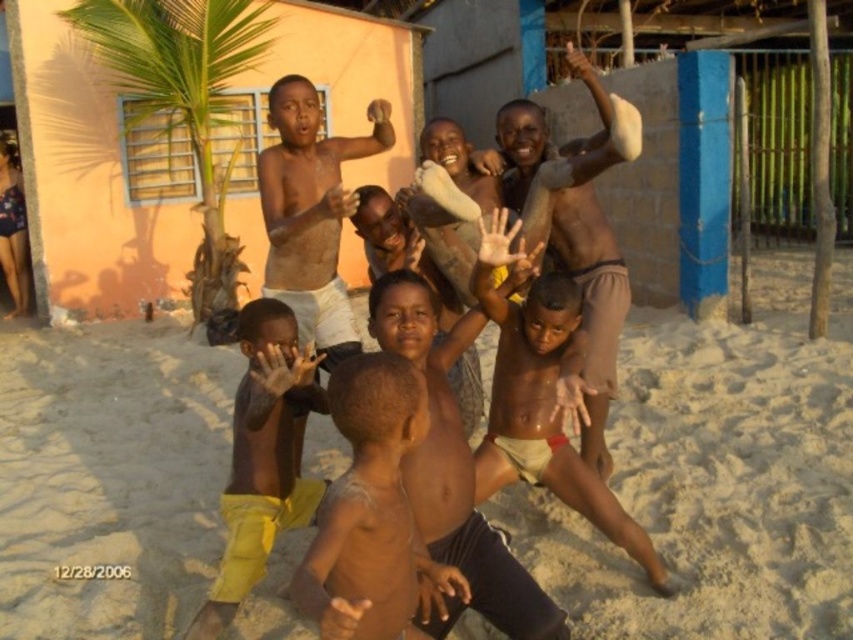
Who is positioned more to the left, brown skin man at center or shiny skin boy at center?

shiny skin boy at center is more to the left.

Can you confirm if brown skin man at center is shorter than shiny skin boy at center?

No.

Where is `brown skin man at center`? The height and width of the screenshot is (640, 853). brown skin man at center is located at coordinates (573, 237).

The height and width of the screenshot is (640, 853). Identify the location of brown skin man at center. (573, 237).

Does matte skin child at center have a lesser width compared to brown skin man at center?

Incorrect, matte skin child at center's width is not less than brown skin man at center's.

Does point (538, 422) lie in front of point (590, 189)?

That is True.

This screenshot has height=640, width=853. I want to click on matte skin child at center, so click(x=541, y=397).

Does point (695, 426) come farther from viewer compared to point (299, 413)?

That is True.

In the scene shown: Can you confirm if sandy beach at center is positioned above yellow fabric pants at lower left?

No, sandy beach at center is not above yellow fabric pants at lower left.

Is point (204, 588) closer to viewer compared to point (248, 461)?

No, (204, 588) is behind (248, 461).

The width and height of the screenshot is (853, 640). Identify the location of sandy beach at center. (718, 476).